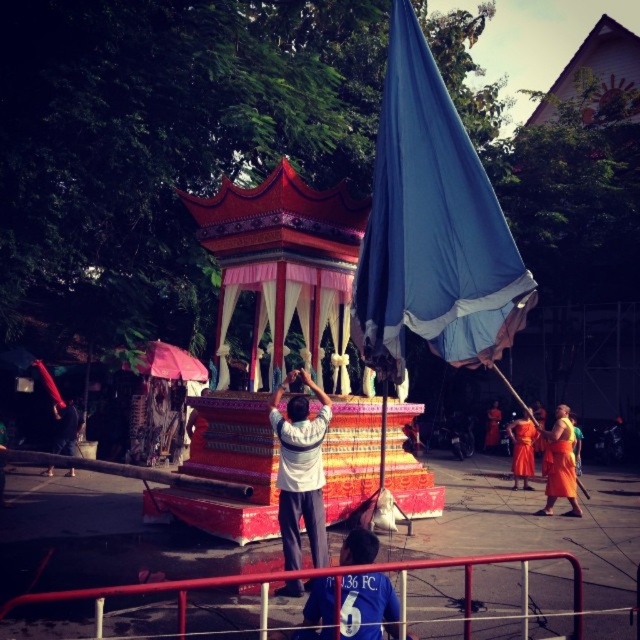
Question: Does white matte shirt at center appear over orange cloth at right?

Choices:
 (A) yes
 (B) no

Answer: (A)

Question: Among these points, which one is nearest to the camera?

Choices:
 (A) (252, 188)
 (B) (577, 516)
 (C) (513, 456)

Answer: (B)

Question: Does orange cloth at right have a larger size compared to orange fabric person at center?

Choices:
 (A) yes
 (B) no

Answer: (A)

Question: Is polychrome painted wooden gazebo at center further to the viewer compared to orange cloth at right?

Choices:
 (A) yes
 (B) no

Answer: (B)

Question: Among these points, which one is farthest from the camera?

Choices:
 (A) (307, 189)
 (B) (516, 483)
 (C) (422, 154)
 (D) (547, 484)

Answer: (B)

Question: Based on their relative distances, which object is nearer to the blue fabric flag at center?

Choices:
 (A) orange fabric person at center
 (B) orange cloth at right

Answer: (B)